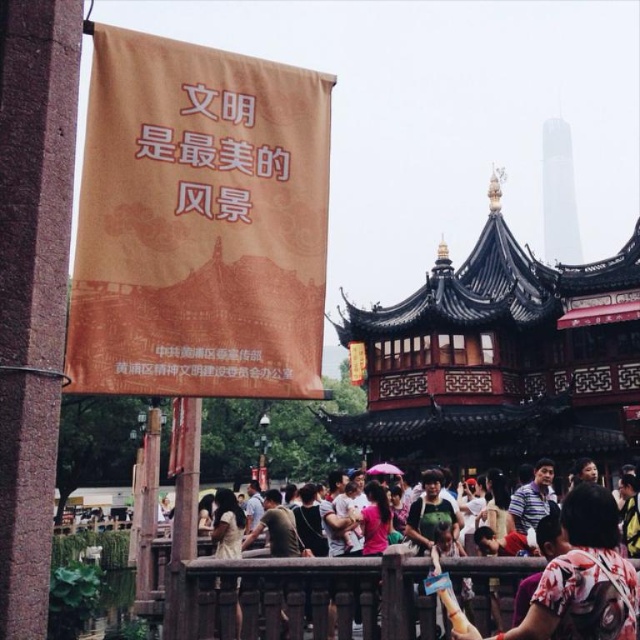
Question: Which point is farther to the camera?

Choices:
 (A) light yellow fabric at center
 (B) matte pink shirt at center

Answer: (B)

Question: Does light yellow fabric at center appear over matte pink shirt at center?

Choices:
 (A) no
 (B) yes

Answer: (A)

Question: Which object is closer to the camera taking this photo?

Choices:
 (A) matte pink shirt at center
 (B) light yellow fabric at center

Answer: (B)

Question: Can you confirm if light yellow fabric at center is positioned to the right of matte pink shirt at center?

Choices:
 (A) yes
 (B) no

Answer: (B)

Question: Is light yellow fabric at center bigger than matte pink shirt at center?

Choices:
 (A) no
 (B) yes

Answer: (B)